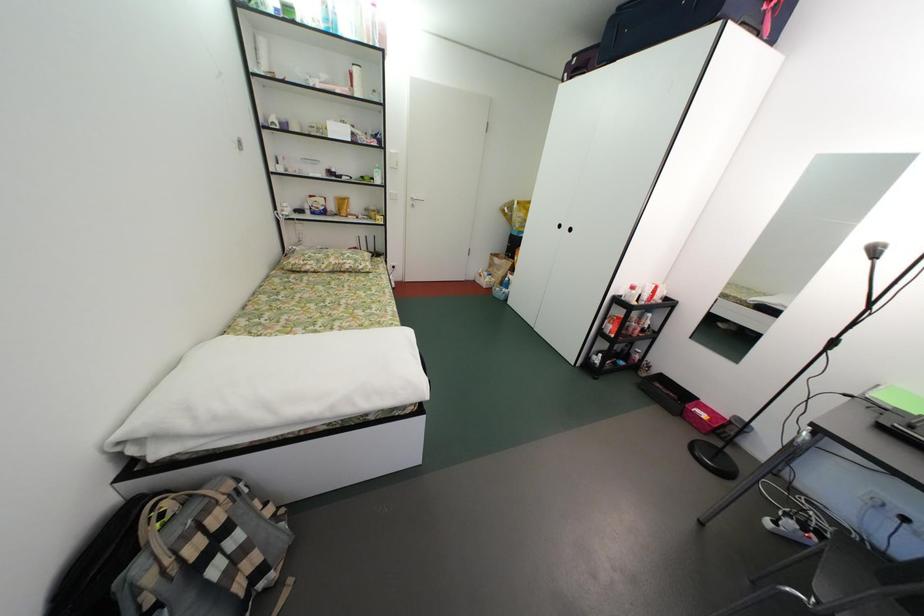
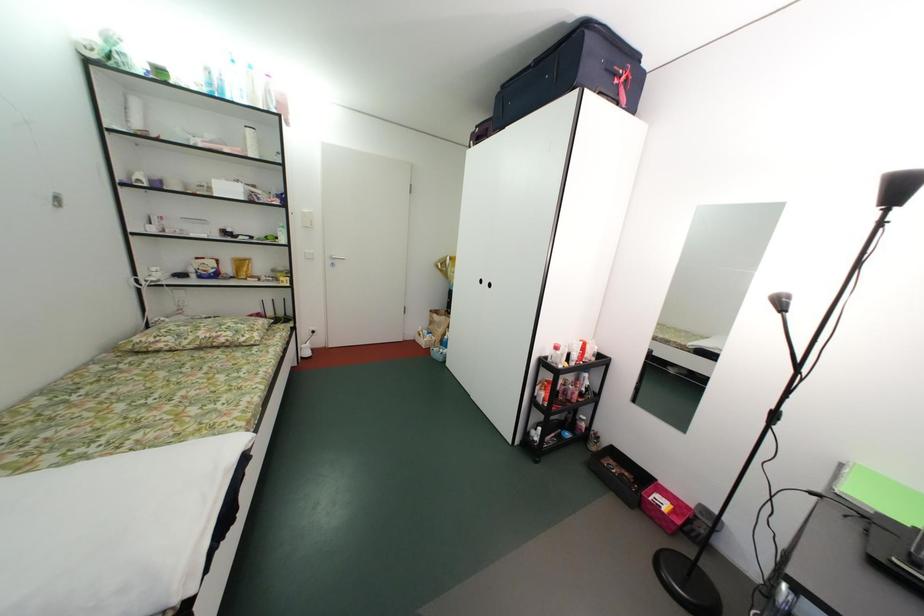
Question: The first image is from the beginning of the video and the second image is from the end. How did the camera likely rotate when shooting the video?

Choices:
 (A) Left
 (B) Right
 (C) Up
 (D) Down

Answer: (C)